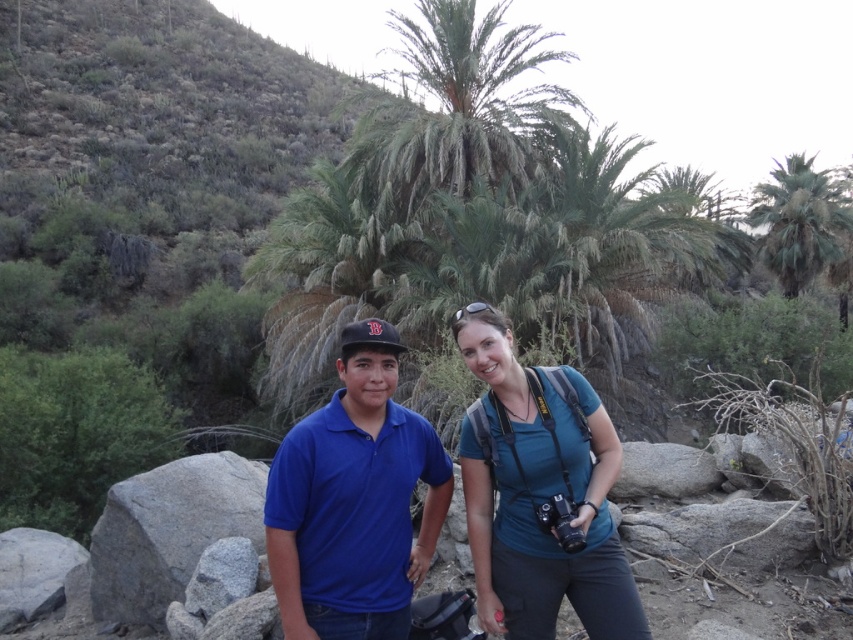
You are a photographer trying to capture a clear shot of the blue cotton shirt at center and the matte blue polo shirt at center. Which one is positioned higher in the frame?

The blue cotton shirt at center is positioned higher in the frame than the matte blue polo shirt at center.

You are standing in the desert scene and want to take a photo of the gray granite rock at lower left and the green leafy palm tree at upper right. Which object is positioned to the left of the other?

The gray granite rock at lower left is to the left of the green leafy palm tree at upper right.

You are a geologist exploring the desert area and need to locate the gray granite rock at lower left. According to the coordinates provided, where exactly is it positioned in the image?

The gray granite rock at lower left is located at point (169, 531) in the image.